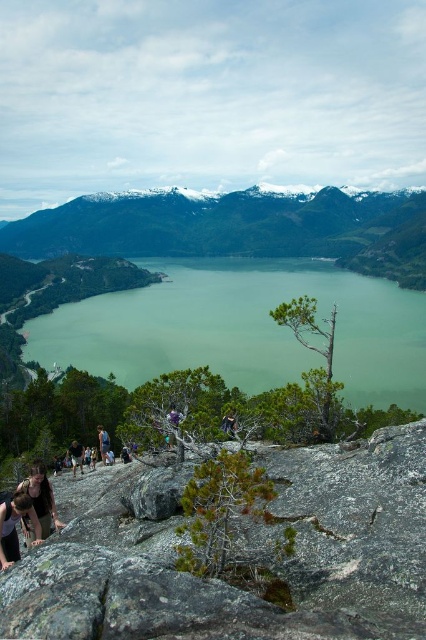
Question: Which of the following is the closest to the observer?

Choices:
 (A) (221, 202)
 (B) (166, 348)
 (C) (103, 451)
 (D) (71, 452)

Answer: (C)

Question: Can you confirm if dark brown leather jacket at lower left is smaller than dark blue shirt at center?

Choices:
 (A) no
 (B) yes

Answer: (B)

Question: Which of these objects is positioned closest to the dark blue shirt at center?

Choices:
 (A) gray rough rock at lower center
 (B) greenish water at center
 (C) dark brown leather jacket at lower left
 (D) snowy granite mountains at center

Answer: (C)

Question: Is gray rough rock at lower center thinner than greenish water at center?

Choices:
 (A) no
 (B) yes

Answer: (B)

Question: Can you confirm if snowy granite mountains at center is positioned to the left of dark brown leather jacket at lower left?

Choices:
 (A) no
 (B) yes

Answer: (B)

Question: Among these objects, which one is nearest to the camera?

Choices:
 (A) dark blue shirt at center
 (B) gray rough rock at lower center

Answer: (B)